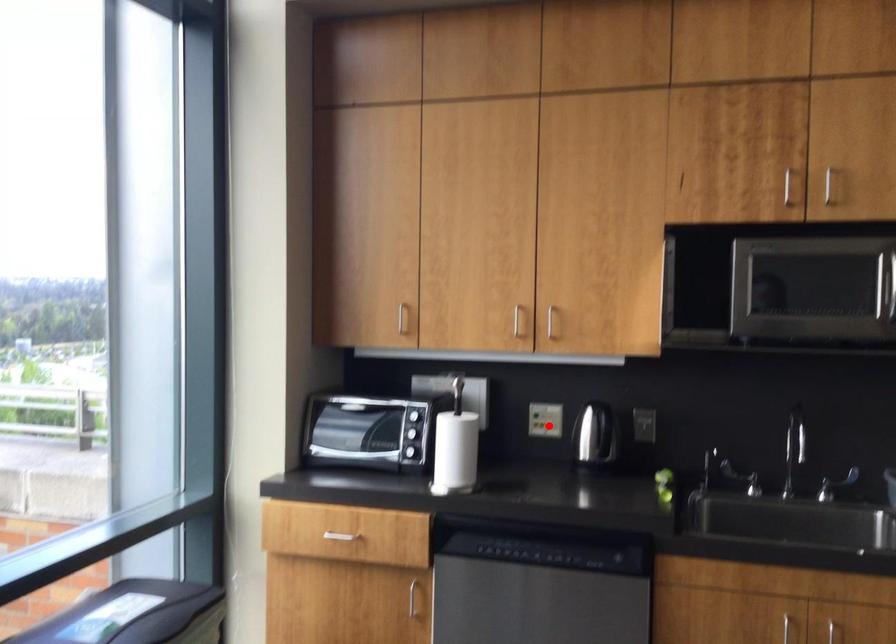
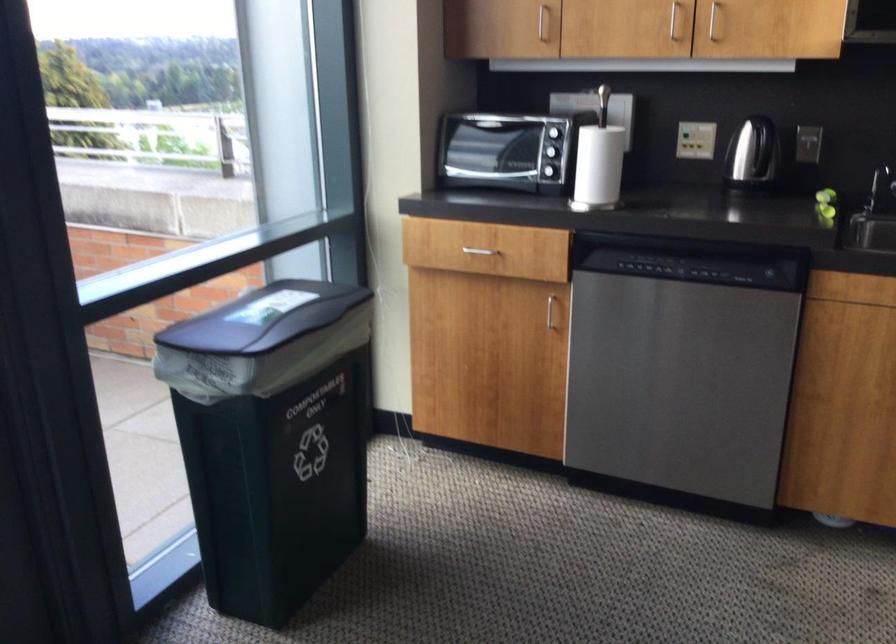
Question: I am providing you with two images of the same scene from different viewpoints. In image1, a red point is highlighted. Considering the same 3D point in image2, which of the following is correct?

Choices:
 (A) It is closer
 (B) It is farther

Answer: (A)